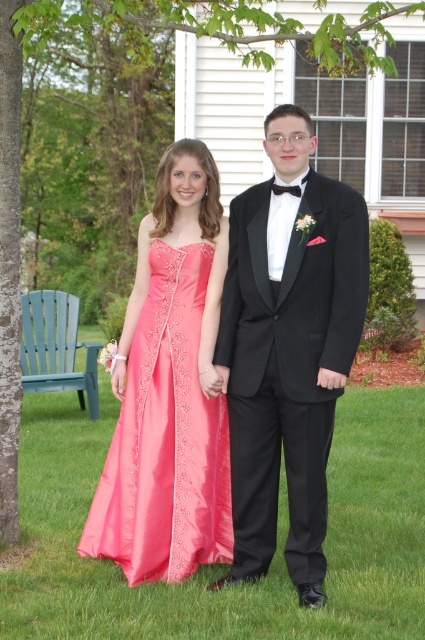
The image size is (425, 640). In order to click on green grass at center in this screenshot , I will do `click(224, 564)`.

Measure the distance between point (257, 632) and camera.

Point (257, 632) is 3.52 meters from camera.

Is point (68, 464) positioned in front of point (300, 564)?

No, (68, 464) is further to viewer.

This screenshot has height=640, width=425. I want to click on green grass at center, so click(224, 564).

Does green grass at center appear over shiny pink satin dress at center?

No.

Is green grass at center shorter than shiny pink satin dress at center?

Yes, green grass at center is shorter than shiny pink satin dress at center.

The height and width of the screenshot is (640, 425). Identify the location of green grass at center. (224, 564).

Locate an element on the screen. green grass at center is located at coordinates (224, 564).

Who is higher up, black satin tuxedo at center or shiny pink satin dress at center?

black satin tuxedo at center

Is the position of black satin tuxedo at center less distant than that of shiny pink satin dress at center?

Yes, it is.

Which is in front, point (275, 116) or point (206, 426)?

Point (275, 116) is more forward.

In order to click on black satin tuxedo at center in this screenshot , I will do `click(288, 348)`.